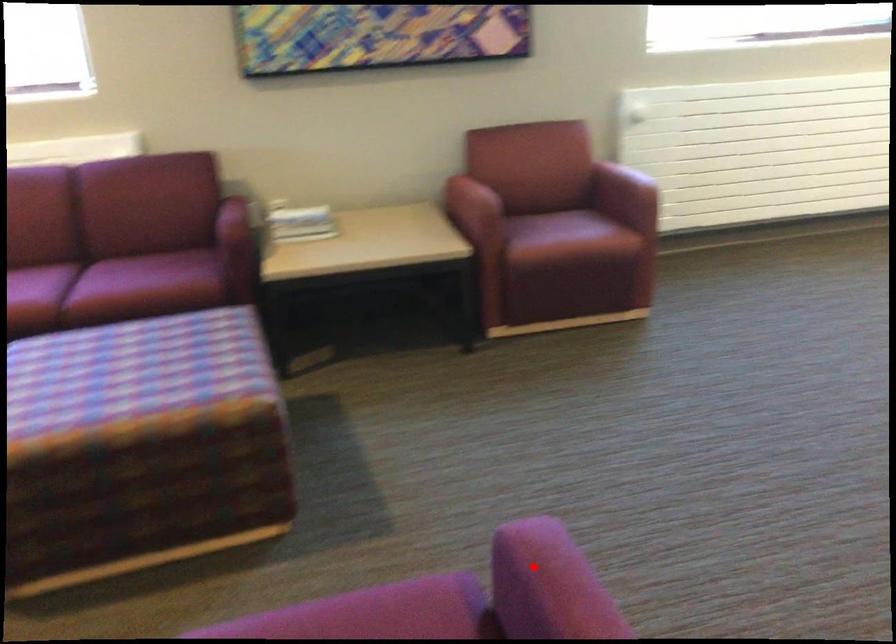
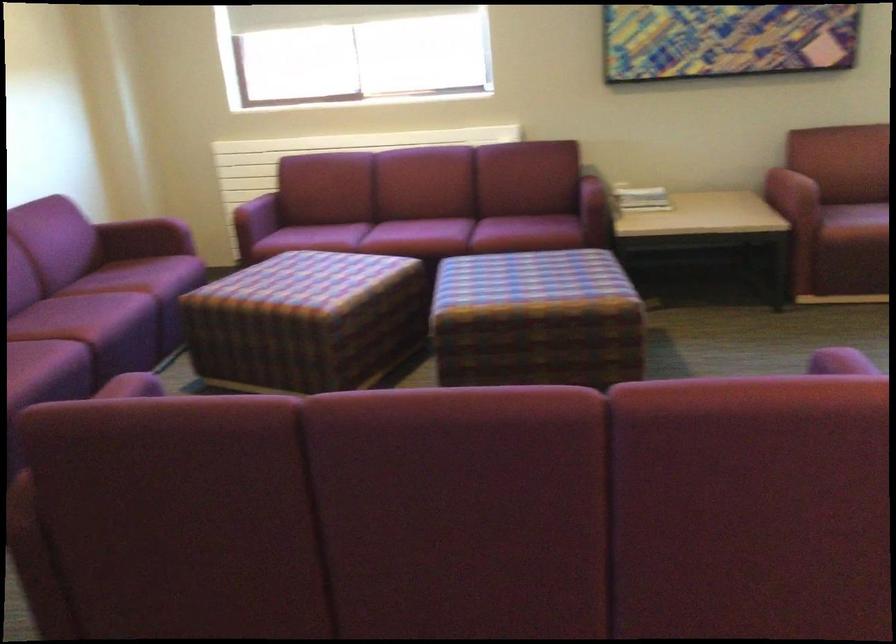
Question: I am providing you with two images of the same scene from different viewpoints. A red point is shown in image1. For the corresponding object point in image2, is it positioned nearer or farther from the camera?

Choices:
 (A) Nearer
 (B) Farther

Answer: (B)